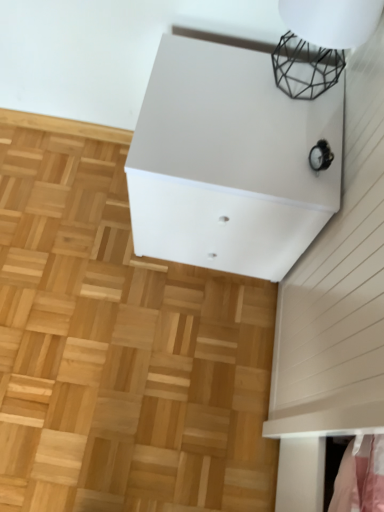
Locate an element on the screen. The width and height of the screenshot is (384, 512). vacant area in front of white matte cabinet at upper center is located at coordinates (182, 333).